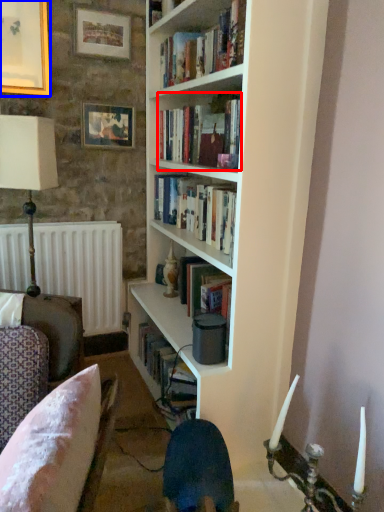
Question: Which object is closer to the camera taking this photo, book (highlighted by a red box) or picture frame (highlighted by a blue box)?

Choices:
 (A) book
 (B) picture frame

Answer: (A)